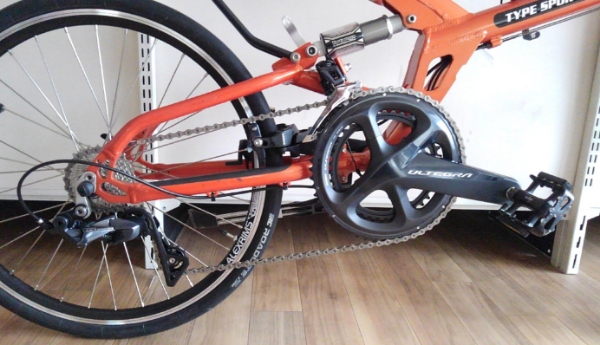
The image size is (600, 345). I want to click on cabinet legs, so click(146, 90), click(589, 145).